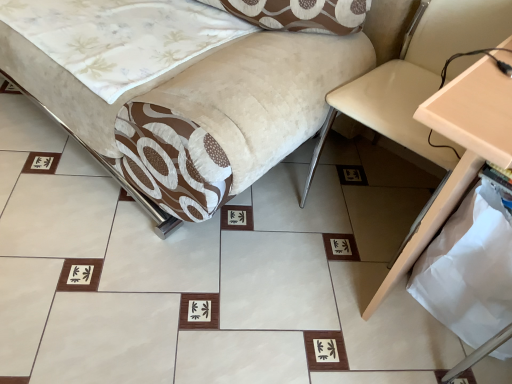
The height and width of the screenshot is (384, 512). Find the location of `empty space that is in between beige leather swivel chair at right and beige wood table at right`. empty space that is in between beige leather swivel chair at right and beige wood table at right is located at coordinates (324, 265).